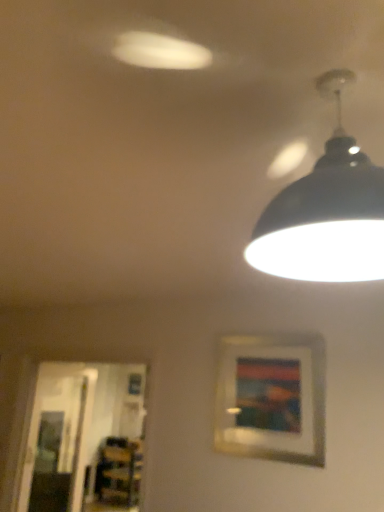
Question: Does wooden bookshelf at lower left have a greater height compared to transparent glass door at lower left, which is the second glass door in back-to-front order?

Choices:
 (A) no
 (B) yes

Answer: (A)

Question: Is wooden bookshelf at lower left behind transparent glass door at lower left, the 2th glass door in the left-to-right sequence?

Choices:
 (A) no
 (B) yes

Answer: (B)

Question: Does wooden bookshelf at lower left have a smaller size compared to transparent glass door at lower left, placed as the 1th glass door when sorted from front to back?

Choices:
 (A) yes
 (B) no

Answer: (A)

Question: Would you consider wooden bookshelf at lower left to be distant from transparent glass door at lower left, arranged as the 1th glass door when viewed from the right?

Choices:
 (A) no
 (B) yes

Answer: (A)

Question: Is the position of wooden bookshelf at lower left less distant than that of transparent glass door at lower left, arranged as the 1th glass door when viewed from the right?

Choices:
 (A) yes
 (B) no

Answer: (B)

Question: Considering the positions of transparent glass door at left, acting as the 1th glass door starting from the left, and wooden picture frame at center in the image, is transparent glass door at left, acting as the 1th glass door starting from the left, bigger or smaller than wooden picture frame at center?

Choices:
 (A) big
 (B) small

Answer: (A)

Question: Is point (31, 493) positioned closer to the camera than point (278, 355)?

Choices:
 (A) closer
 (B) farther

Answer: (B)

Question: From a real-world perspective, is transparent glass door at left, arranged as the 2th glass door when viewed from the right, physically located above or below wooden picture frame at center?

Choices:
 (A) below
 (B) above

Answer: (A)

Question: From their relative heights in the image, would you say transparent glass door at left, arranged as the 2th glass door when viewed from the right, is taller or shorter than wooden picture frame at center?

Choices:
 (A) short
 (B) tall

Answer: (B)

Question: Based on their positions, is black matte lampshade at upper right located to the left or right of transparent glass door at lower left, the 2th glass door in the left-to-right sequence?

Choices:
 (A) right
 (B) left

Answer: (A)

Question: Do you think black matte lampshade at upper right is within transparent glass door at lower left, placed as the 1th glass door when sorted from front to back, or outside of it?

Choices:
 (A) outside
 (B) inside

Answer: (A)

Question: From their relative heights in the image, would you say black matte lampshade at upper right is taller or shorter than transparent glass door at lower left, the 2th glass door in the left-to-right sequence?

Choices:
 (A) short
 (B) tall

Answer: (A)

Question: From a real-world perspective, is black matte lampshade at upper right above or below transparent glass door at lower left, the 2th glass door in the left-to-right sequence?

Choices:
 (A) above
 (B) below

Answer: (A)

Question: Is wooden bookshelf at lower left spatially inside transparent glass door at lower left, placed as the 1th glass door when sorted from front to back, or outside of it?

Choices:
 (A) inside
 (B) outside

Answer: (B)

Question: In terms of width, does wooden bookshelf at lower left look wider or thinner when compared to transparent glass door at lower left, which is the second glass door in back-to-front order?

Choices:
 (A) thin
 (B) wide

Answer: (B)